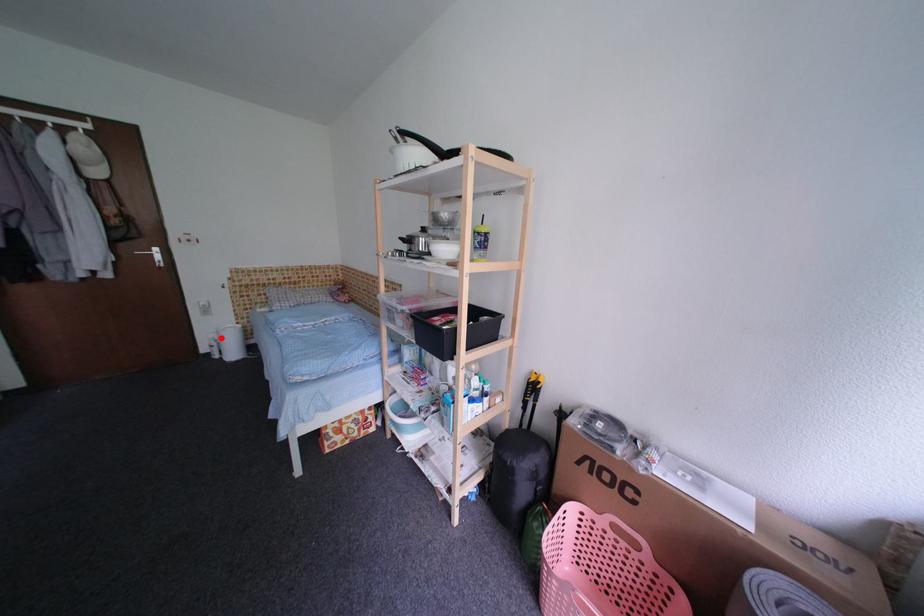
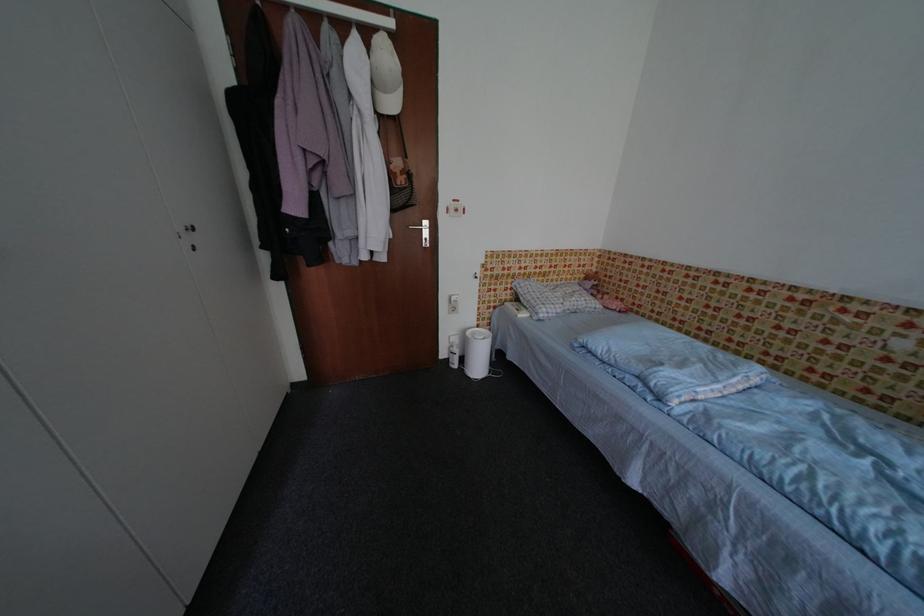
Locate, in the second image, the point that corresponds to the highlighted location in the first image.

(464, 342)